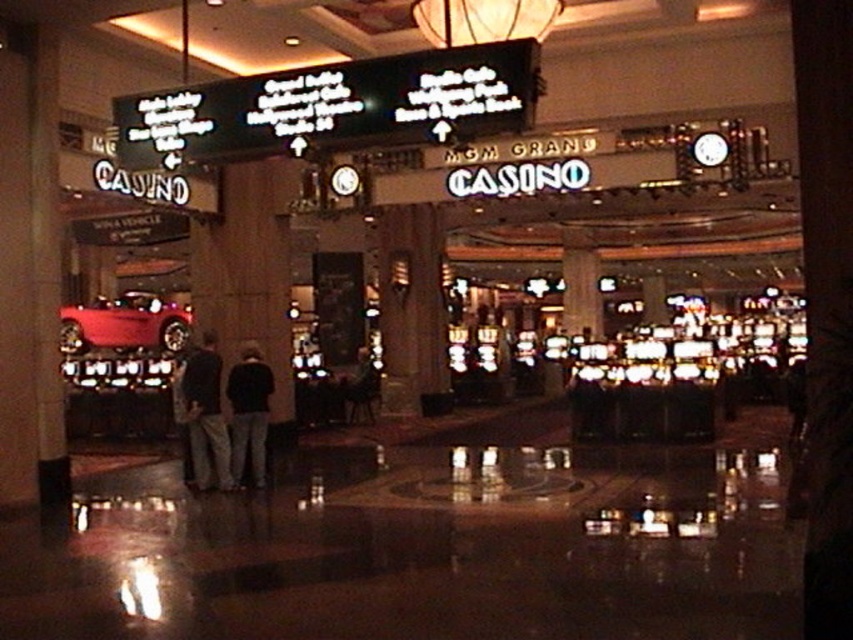
Looking at this image, you are a photographer planning to take a wide shot of the MGM Grand Casino interior. You need to include both the shiny red car at left and the dark fabric pants at center in your frame. Considering their sizes, which object should you focus on to ensure both are clearly visible in the photo?

The shiny red car at left is larger than the dark fabric pants at center, so focusing on the shiny red car at left will help ensure both objects are clearly visible in the wide shot.

You are standing at the entrance of the MGM Grand Casino and notice a point marked at coordinates (x=206, y=413). What object is located at this point?

The point at coordinates (x=206, y=413) corresponds to dark clothing at center.

You are standing at the point labeled point at (x=154, y=339) in the MGM Grand Casino. The main entrance is located at the other end of the casino floor. If you start walking straight towards the main entrance, how far will you have to walk to reach it?

The distance between the point at (x=154, y=339) and the main entrance is 19.31 meters, so you will have to walk 19.31 meters to reach the main entrance.